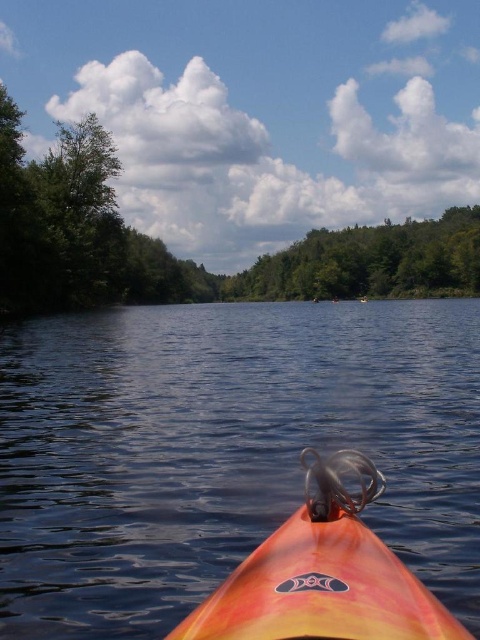
Question: Is orange matte kayak at lower center wider than green leafy trees at upper center?

Choices:
 (A) no
 (B) yes

Answer: (A)

Question: Does orange matte kayak at lower center have a larger size compared to green leafy trees at upper center?

Choices:
 (A) yes
 (B) no

Answer: (B)

Question: Can you confirm if green leafy tree at upper center is bigger than orange matte kayak at lower center?

Choices:
 (A) yes
 (B) no

Answer: (A)

Question: Which point is farther from the camera taking this photo?

Choices:
 (A) (224, 280)
 (B) (186, 397)
 (C) (339, 252)

Answer: (A)

Question: Which object appears closest to the camera in this image?

Choices:
 (A) orange matte kayak at lower center
 (B) green leafy tree at upper center

Answer: (A)

Question: Considering the real-world distances, which object is closest to the orange plastic kayak at lower center?

Choices:
 (A) green leafy trees at upper center
 (B) green leafy tree at upper center

Answer: (B)